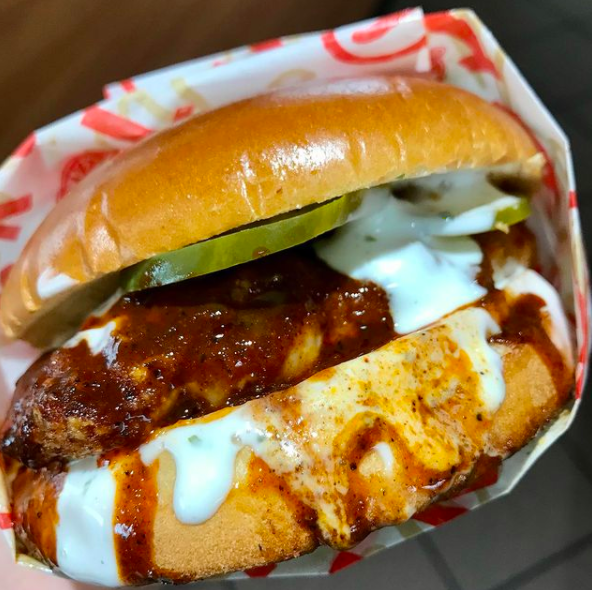
You are a GUI agent. You are given a task and a screenshot of the screen. Output one action in this format:
    pyautogui.click(x=<x>, y=<y>)
    Task: Click on the table
    The height and width of the screenshot is (590, 592).
    Given the screenshot: What is the action you would take?
    pyautogui.click(x=137, y=37)